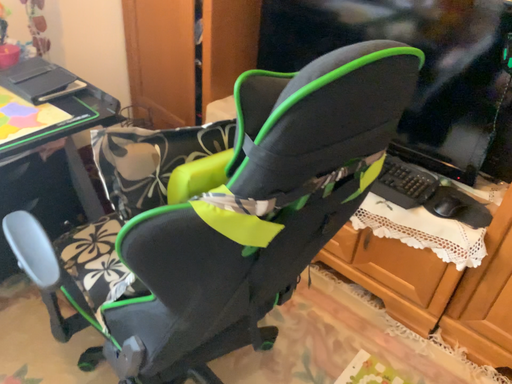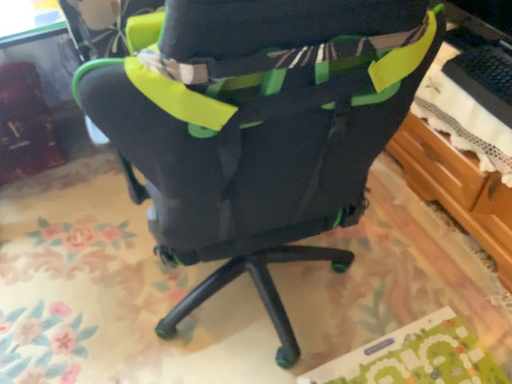
Question: How did the camera likely rotate when shooting the video?

Choices:
 (A) rotated upward
 (B) rotated downward

Answer: (B)